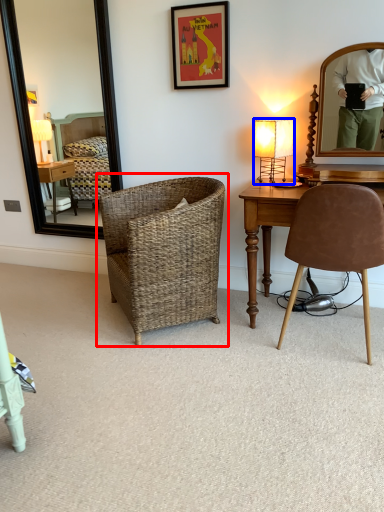
Question: Which object appears farthest to the camera in this image, chair (highlighted by a red box) or lamp (highlighted by a blue box)?

Choices:
 (A) chair
 (B) lamp

Answer: (B)